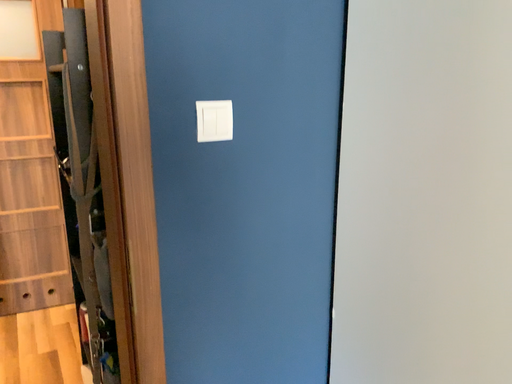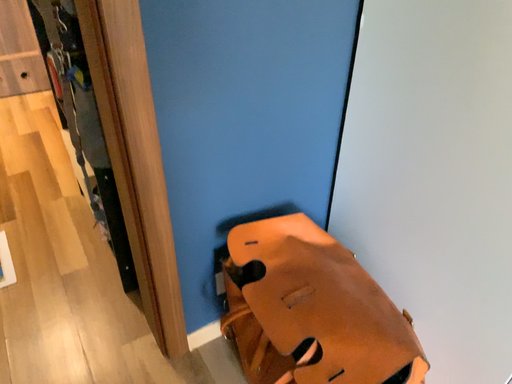
Question: How did the camera likely rotate when shooting the video?

Choices:
 (A) rotated downward
 (B) rotated upward

Answer: (A)